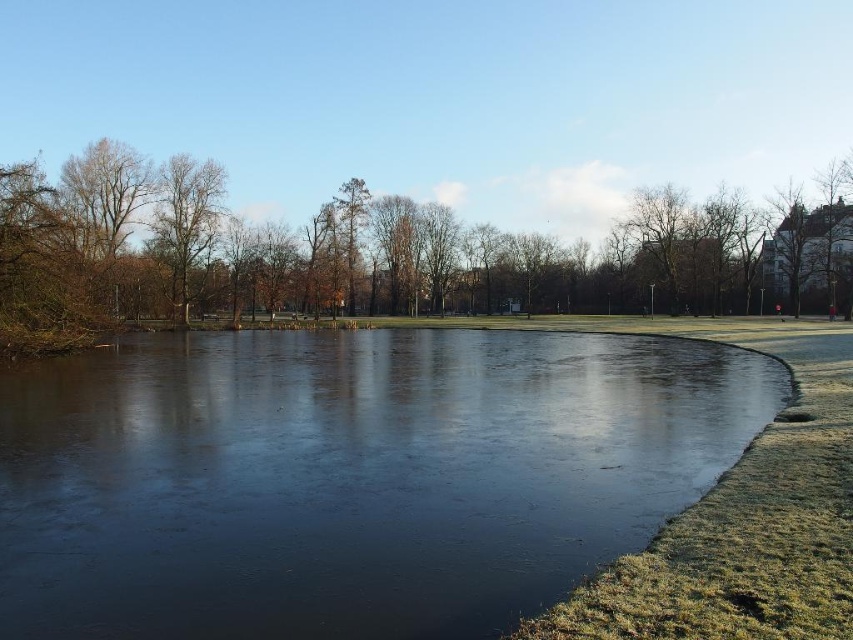
Is transparent ice at center bigger than bare wood tree at upper left?

No, transparent ice at center is not bigger than bare wood tree at upper left.

Which is in front, point (189, 506) or point (189, 252)?

Positioned in front is point (189, 506).

Where is `transparent ice at center`? transparent ice at center is located at coordinates (349, 477).

Which of these two, transparent ice at center or brown leafless tree at upper left, stands taller?

Standing taller between the two is brown leafless tree at upper left.

Which is in front, point (125, 579) or point (733, 296)?

Point (125, 579) is more forward.

In order to click on transparent ice at center in this screenshot , I will do `click(349, 477)`.

Locate an element on the screen. transparent ice at center is located at coordinates (349, 477).

From the picture: Measure the distance from brown leafless tree at upper left to bare wood tree at upper left.

A distance of 40.51 feet exists between brown leafless tree at upper left and bare wood tree at upper left.

The height and width of the screenshot is (640, 853). I want to click on brown leafless tree at upper left, so click(376, 256).

Which is in front, point (425, 228) or point (189, 240)?

Point (189, 240)

Where is `brown leafless tree at upper left`? This screenshot has height=640, width=853. brown leafless tree at upper left is located at coordinates (376, 256).